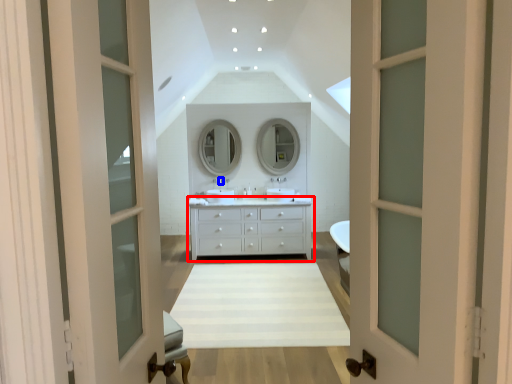
Question: Among these objects, which one is nearest to the camera, chest of drawers (highlighted by a red box) or faucet (highlighted by a blue box)?

Choices:
 (A) chest of drawers
 (B) faucet

Answer: (A)